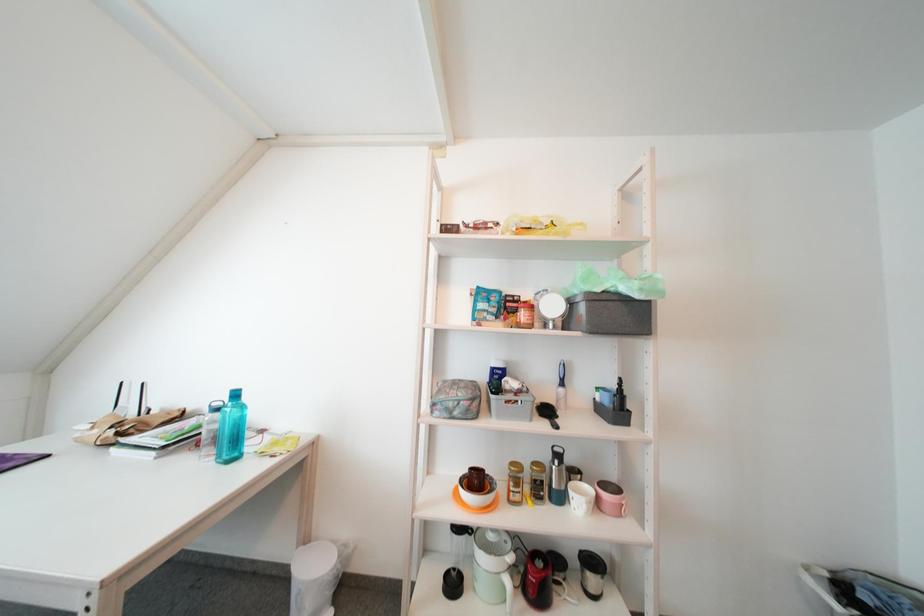
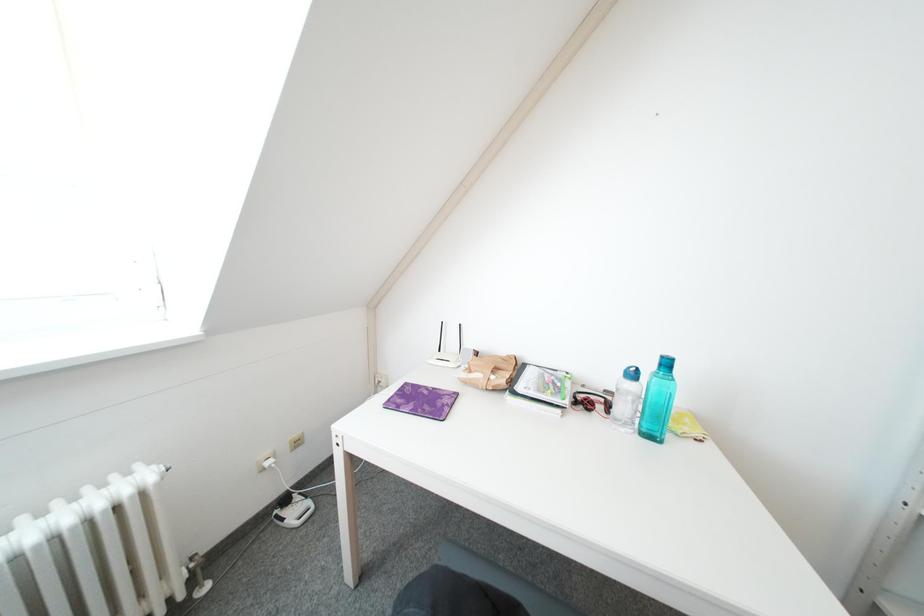
Question: What movement of the cameraman would produce the second image?

Choices:
 (A) Left
 (B) Right
 (C) Forward
 (D) Backward

Answer: (A)